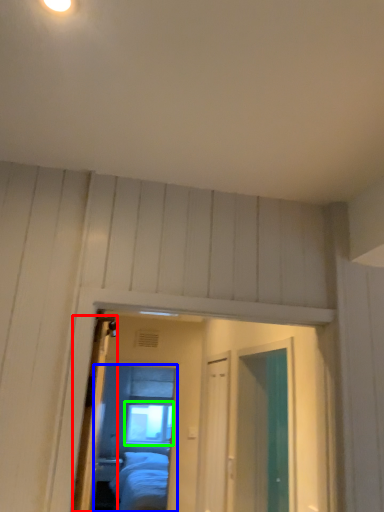
Question: Considering the real-world distances, which object is farthest from door (highlighted by a red box)? mirror (highlighted by a blue box) or window (highlighted by a green box)?

Choices:
 (A) mirror
 (B) window

Answer: (B)